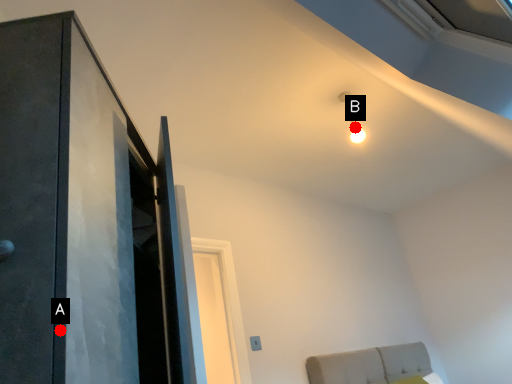
Question: Two points are circled on the image, labeled by A and B beside each circle. Which point is further to the camera?

Choices:
 (A) A is further
 (B) B is further

Answer: (B)